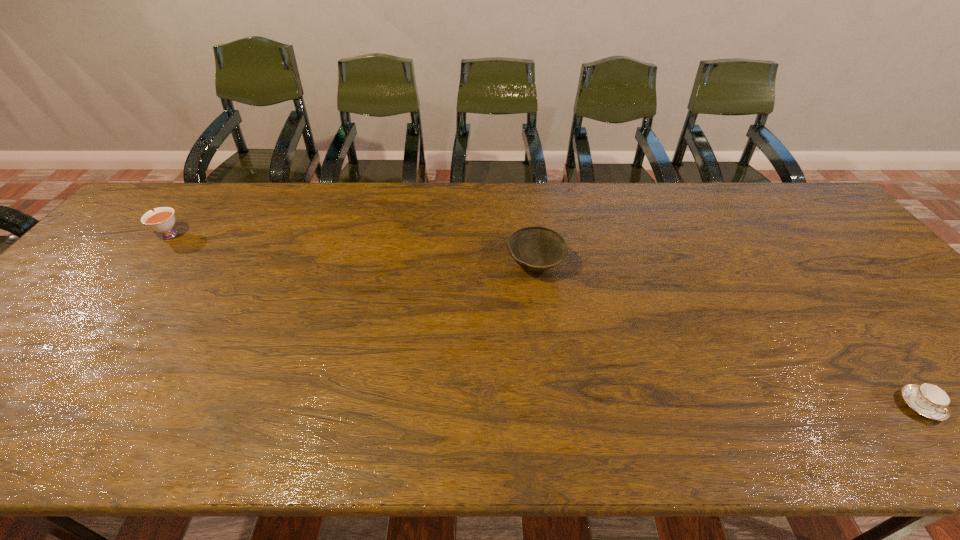
In order to click on bowl in this screenshot , I will do `click(535, 248)`.

You are a GUI agent. You are given a task and a screenshot of the screen. Output one action in this format:
    pyautogui.click(x=<x>, y=<y>)
    Task: Click on the second object from right to left
    This screenshot has height=540, width=960.
    Given the screenshot: What is the action you would take?
    pyautogui.click(x=535, y=248)

In order to click on the left teacup in this screenshot , I will do `click(162, 220)`.

I want to click on the farthest object, so click(x=162, y=220).

The width and height of the screenshot is (960, 540). I want to click on the nearer teacup, so click(x=928, y=400).

Locate an element on the screen. the rightmost object is located at coordinates (928, 400).

This screenshot has height=540, width=960. Identify the location of vacant space located on the front of the bowl. (547, 355).

What are the coordinates of `vacant region located 0.060m on the side of the farthest object with the handle` in the screenshot? It's located at (132, 235).

This screenshot has height=540, width=960. Identify the location of object that is positioned at the near edge. (928, 400).

The height and width of the screenshot is (540, 960). Find the location of `object that is at the left edge`. object that is at the left edge is located at coordinates 162,220.